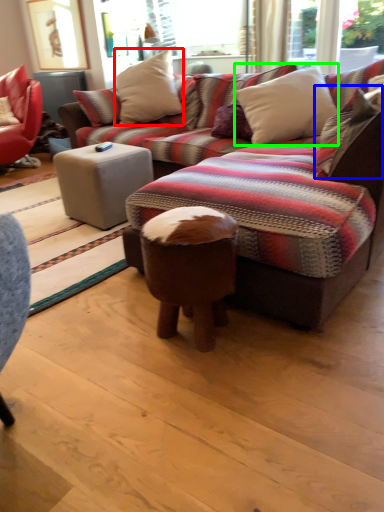
Question: Considering the real-world distances, which object is closest to pillow (highlighted by a red box)? pillow (highlighted by a blue box) or pillow (highlighted by a green box).

Choices:
 (A) pillow
 (B) pillow

Answer: (B)